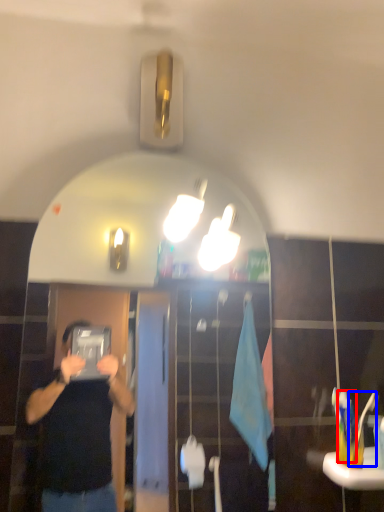
Question: Which of the following is the farthest to the observer, toothbrush (highlighted by a red box) or toothbrush (highlighted by a blue box)?

Choices:
 (A) toothbrush
 (B) toothbrush

Answer: (A)